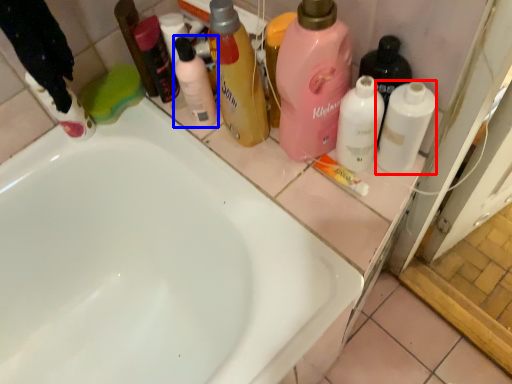
Question: Which of the following is the farthest to the observer, cleaning product (highlighted by a red box) or cleaning product (highlighted by a blue box)?

Choices:
 (A) cleaning product
 (B) cleaning product

Answer: (B)